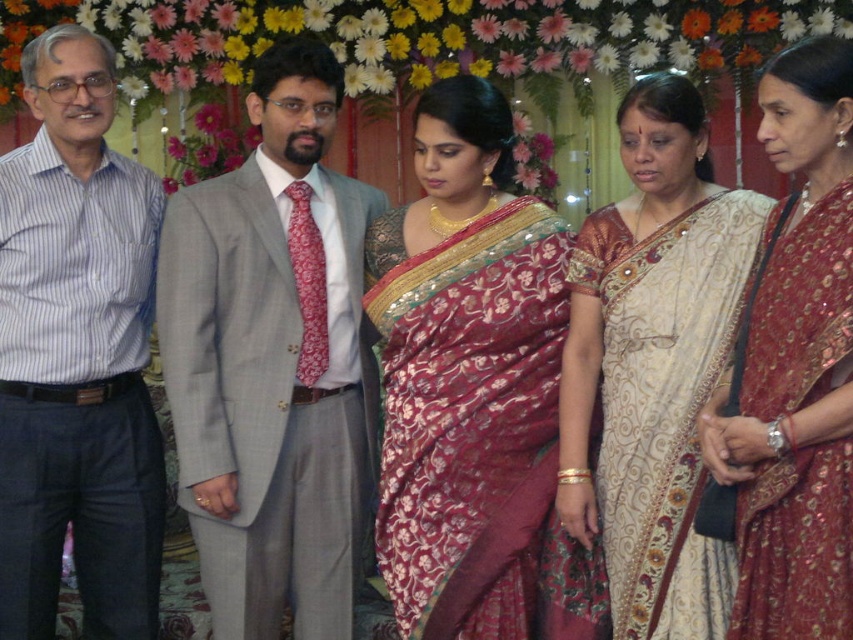
Question: Estimate the real-world distances between objects in this image. Which object is closer to the white silk saree at center?

Choices:
 (A) maroon silk saree at center
 (B) striped cotton shirt at left

Answer: (A)

Question: Observing the image, what is the correct spatial positioning of light gray suit at center in reference to shiny maroon saree at center?

Choices:
 (A) above
 (B) below

Answer: (B)

Question: In this image, where is light gray suit at center located relative to maroon silk saree at center?

Choices:
 (A) right
 (B) left

Answer: (B)

Question: Which object appears closest to the camera in this image?

Choices:
 (A) striped cotton shirt at left
 (B) shiny maroon saree at center
 (C) maroon silk saree at center

Answer: (B)

Question: Which of the following is the farthest from the observer?

Choices:
 (A) white silk saree at center
 (B) light gray suit at center
 (C) shiny maroon saree at center
 (D) maroon silk saree at center

Answer: (B)

Question: Does maroon silk saree at center appear on the right side of shiny maroon saree at center?

Choices:
 (A) yes
 (B) no

Answer: (B)